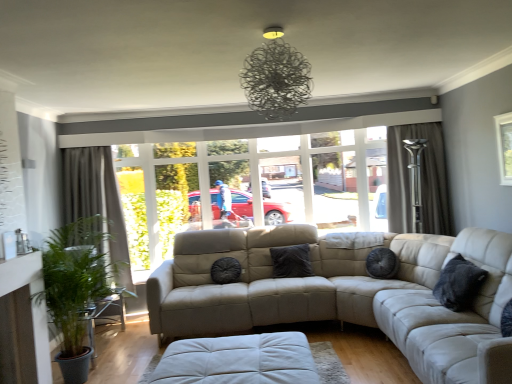
Question: Considering the relative positions of matte beige couch at center and green leafy plant at left in the image provided, is matte beige couch at center in front of green leafy plant at left?

Choices:
 (A) no
 (B) yes

Answer: (A)

Question: Is matte beige couch at center thinner than green leafy plant at left?

Choices:
 (A) yes
 (B) no

Answer: (A)

Question: Is matte beige couch at center wider than green leafy plant at left?

Choices:
 (A) yes
 (B) no

Answer: (B)

Question: Is matte beige couch at center to the right of green leafy plant at left from the viewer's perspective?

Choices:
 (A) no
 (B) yes

Answer: (B)

Question: Does matte beige couch at center touch green leafy plant at left?

Choices:
 (A) no
 (B) yes

Answer: (A)

Question: Based on their positions, is dark gray textured pillow at right, which ranks as the first pillow in front-to-back order, located to the left or right of metallic wire chandelier at upper center?

Choices:
 (A) right
 (B) left

Answer: (A)

Question: Is dark gray textured pillow at right, which ranks as the first pillow in front-to-back order, inside the boundaries of metallic wire chandelier at upper center, or outside?

Choices:
 (A) outside
 (B) inside

Answer: (A)

Question: In the image, is dark gray textured pillow at right, which ranks as the first pillow in front-to-back order, positioned in front of or behind metallic wire chandelier at upper center?

Choices:
 (A) behind
 (B) front

Answer: (A)

Question: Considering the positions of dark gray textured pillow at right, the 1th pillow positioned from the right, and metallic wire chandelier at upper center in the image, is dark gray textured pillow at right, the 1th pillow positioned from the right, wider or thinner than metallic wire chandelier at upper center?

Choices:
 (A) thin
 (B) wide

Answer: (A)

Question: Looking at their shapes, would you say black textured pillow at center, placed as the second pillow when sorted from front to back, is wider or thinner than green leafy plant at left?

Choices:
 (A) thin
 (B) wide

Answer: (A)

Question: Would you say black textured pillow at center, the second pillow from the back, is inside or outside green leafy plant at left?

Choices:
 (A) inside
 (B) outside

Answer: (B)

Question: Is black textured pillow at center, acting as the 1th pillow starting from the left, in front of or behind green leafy plant at left in the image?

Choices:
 (A) behind
 (B) front

Answer: (A)

Question: Would you say black textured pillow at center, acting as the 1th pillow starting from the left, is to the left or to the right of green leafy plant at left in the picture?

Choices:
 (A) left
 (B) right

Answer: (B)

Question: From a real-world perspective, is dark gray textured curtain at left, placed as the first curtain when sorted from left to right, physically located above or below black textured pillow at center, the 3th pillow when ordered from right to left?

Choices:
 (A) below
 (B) above

Answer: (B)

Question: Is point (95, 208) closer or farther from the camera than point (224, 258)?

Choices:
 (A) farther
 (B) closer

Answer: (A)